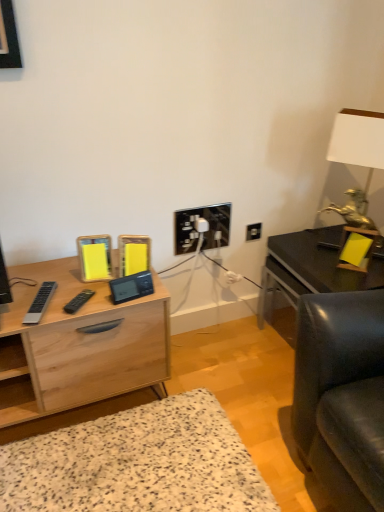
Question: Considering the positions of black plastic electric outlet at center and light wood desk at center in the image, is black plastic electric outlet at center wider or thinner than light wood desk at center?

Choices:
 (A) thin
 (B) wide

Answer: (A)

Question: From the image's perspective, is black plastic electric outlet at center located above or below light wood desk at center?

Choices:
 (A) below
 (B) above

Answer: (B)

Question: Which is farther from the white matte table lamp at upper right?

Choices:
 (A) light wood desk at center
 (B) black plastic electric outlet at center
 (C) matte black table at right

Answer: (A)

Question: Considering the real-world distances, which object is closest to the black plastic electric outlet at center?

Choices:
 (A) light wood desk at center
 (B) white matte table lamp at upper right
 (C) matte black table at right

Answer: (C)